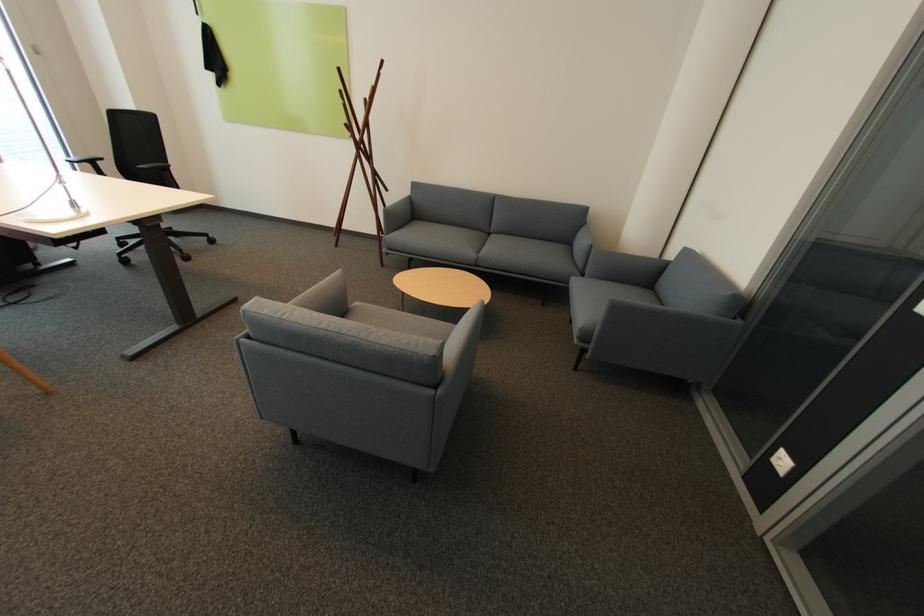
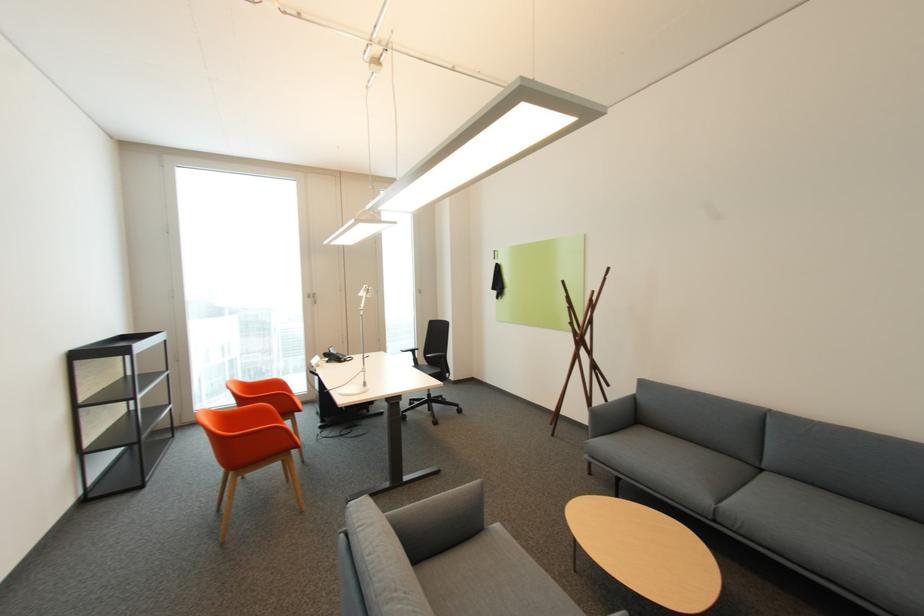
The first image is from the beginning of the video and the second image is from the end. How did the camera likely rotate when shooting the video?

The camera rotated toward left-up.